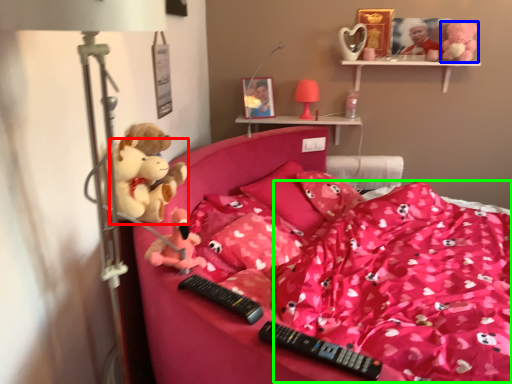
Question: Based on their relative distances, which object is farther from toy (highlighted by a red box)? Choose from toy (highlighted by a blue box) and blanket (highlighted by a green box).

Choices:
 (A) toy
 (B) blanket

Answer: (A)